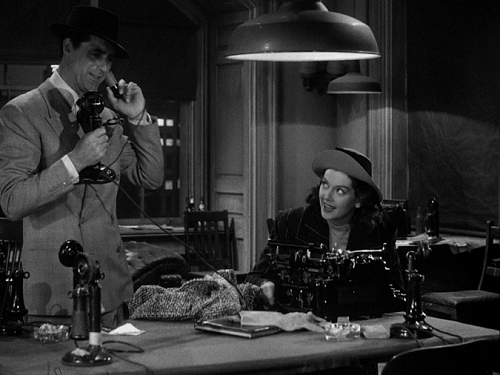
The image size is (500, 375). What are the coordinates of `telephones` in the screenshot? It's located at (96, 298), (416, 299), (93, 119).